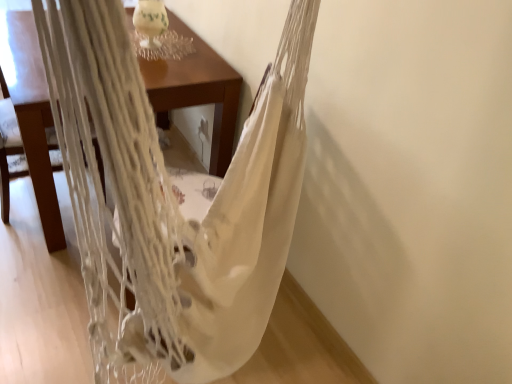
You are a GUI agent. You are given a task and a screenshot of the screen. Output one action in this format:
    pyautogui.click(x=<x>, y=<y>)
    Task: Click on the wooden table at center
    
    Given the screenshot: What is the action you would take?
    pyautogui.click(x=32, y=114)

Where is `white macrame hammock at center`? Image resolution: width=512 pixels, height=384 pixels. white macrame hammock at center is located at coordinates (250, 218).

In the scene shown: From a real-world perspective, who is located higher, white macrame hammock at center or white woven hammock at upper left?

white macrame hammock at center is physically above.

Find the location of a particular element. The width and height of the screenshot is (512, 384). blanket above the white woven hammock at upper left (from a real-world perspective) is located at coordinates (250, 218).

Is white macrame hammock at center in front of or behind white woven hammock at upper left in the image?

Visually, white macrame hammock at center is located in front of white woven hammock at upper left.

Is white macrame hammock at center oriented away from white woven hammock at upper left?

That's not correct — white macrame hammock at center is not looking away from white woven hammock at upper left.

Is point (209, 212) closer or farther from the camera than point (200, 94)?

Point (209, 212) is closer to the camera than point (200, 94).

In order to click on blanket that appears below the wooden table at center (from the image's perspective) in this screenshot , I will do `click(250, 218)`.

Considering the sizes of objects white macrame hammock at center and wooden table at center in the image provided, who is smaller, white macrame hammock at center or wooden table at center?

white macrame hammock at center.

Is white macrame hammock at center in contact with wooden table at center?

No, white macrame hammock at center is not beside wooden table at center.

From the image's perspective, which is above, white woven hammock at upper left or white macrame hammock at center?

From the image's view, white woven hammock at upper left is above.

Is white woven hammock at upper left inside or outside of white macrame hammock at center?

The correct answer is: outside.

Does point (12, 107) come behind point (222, 319)?

Yes, it is.

Considering the sizes of objects white woven hammock at upper left and wooden table at center in the image provided, who is taller, white woven hammock at upper left or wooden table at center?

Standing taller between the two is white woven hammock at upper left.

In the scene shown: From a real-world perspective, which object rests below the other?

wooden table at center is physically lower.

Can you tell me how much white woven hammock at upper left and wooden table at center differ in facing direction?

177 degrees separate the facing orientations of white woven hammock at upper left and wooden table at center.

Can you confirm if white woven hammock at upper left is thinner than wooden table at center?

Yes.

Considering the sizes of objects wooden table at center and white macrame hammock at center in the image provided, who is wider, wooden table at center or white macrame hammock at center?

wooden table at center is wider.

Is wooden table at center turned away from white macrame hammock at center?

No, wooden table at center's orientation is not away from white macrame hammock at center.

Is point (169, 102) positioned in front of point (272, 166)?

No, it is not.

Based on the photo, from the image's perspective, is wooden table at center located beneath white macrame hammock at center?

Actually, wooden table at center appears above white macrame hammock at center in the image.

Does wooden table at center have a lesser height compared to white woven hammock at upper left?

Correct, wooden table at center is not as tall as white woven hammock at upper left.

Does point (205, 52) appear closer or farther from the camera than point (60, 167)?

Point (205, 52) is farther from the camera than point (60, 167).

Is the surface of wooden table at center in direct contact with white woven hammock at upper left?

No, wooden table at center is not in contact with white woven hammock at upper left.

Is white woven hammock at upper left at the back of wooden table at center?

wooden table at center does not have its back to white woven hammock at upper left.

At what (x,y) coordinates should I click in order to perform the action: click on armchair behind the white macrame hammock at center. Please return your answer as a coordinate pair (x, y). The height and width of the screenshot is (384, 512). Looking at the image, I should click on (7, 145).

You are a GUI agent. You are given a task and a screenshot of the screen. Output one action in this format:
    pyautogui.click(x=<x>, y=<y>)
    Task: Click on the blanket above the wooden table at center (from a real-world perspective)
    
    Given the screenshot: What is the action you would take?
    pyautogui.click(x=250, y=218)

Considering their positions, is wooden table at center positioned further to white macrame hammock at center than white woven hammock at upper left?

Based on the image, white woven hammock at upper left appears to be further to white macrame hammock at center.

Based on their spatial positions, is white woven hammock at upper left or wooden table at center closer to white macrame hammock at center?

The object closer to white macrame hammock at center is wooden table at center.

Looking at the image, which one is located closer to wooden table at center, white macrame hammock at center or white woven hammock at upper left?

white macrame hammock at center is positioned closer to the anchor wooden table at center.

When comparing their distances from wooden table at center, does white woven hammock at upper left or white macrame hammock at center seem further?

The object further to wooden table at center is white woven hammock at upper left.

Based on their spatial positions, is wooden table at center or white macrame hammock at center closer to white woven hammock at upper left?

wooden table at center lies closer to white woven hammock at upper left than the other object.

Consider the image. Considering their positions, is white macrame hammock at center positioned closer to white woven hammock at upper left than wooden table at center?

wooden table at center lies closer to white woven hammock at upper left than the other object.

I want to click on table between white woven hammock at upper left and white macrame hammock at center, so [32, 114].